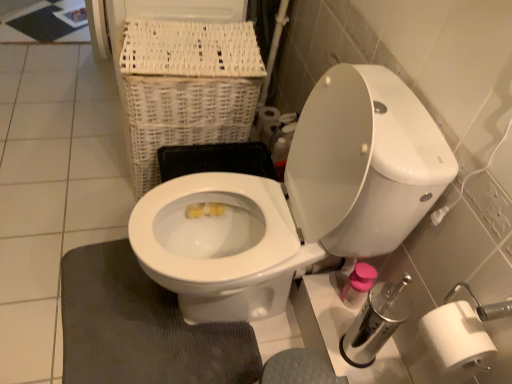
You are a GUI agent. You are given a task and a screenshot of the screen. Output one action in this format:
    pyautogui.click(x=<x>, y=<y>)
    Task: Click on the white glossy toilet at center
    This screenshot has height=384, width=512.
    Given the screenshot: What is the action you would take?
    pyautogui.click(x=298, y=200)

Locate an element on the screen. This screenshot has width=512, height=384. white matte toilet paper at right is located at coordinates (275, 125).

Image resolution: width=512 pixels, height=384 pixels. What do you see at coordinates (141, 328) in the screenshot?
I see `dark gray textured bath mat at lower left` at bounding box center [141, 328].

The image size is (512, 384). Identify the location of white glossy toilet at center. (298, 200).

How many degrees apart are the facing directions of white wicker basket at upper left and dark gray textured bath mat at lower left?

8.86 degrees.

Considering the relative positions of white wicker basket at upper left and dark gray textured bath mat at lower left in the image provided, is white wicker basket at upper left in front of dark gray textured bath mat at lower left?

No, white wicker basket at upper left is behind dark gray textured bath mat at lower left.

Is the surface of white wicker basket at upper left in direct contact with dark gray textured bath mat at lower left?

No, white wicker basket at upper left is not beside dark gray textured bath mat at lower left.

Would you consider white glossy toilet at center to be distant from white matte toilet paper at right?

That's not correct — white glossy toilet at center is a little close to white matte toilet paper at right.

Looking at their sizes, would you say white glossy toilet at center is wider or thinner than white matte toilet paper at right?

In the image, white glossy toilet at center appears to be wider than white matte toilet paper at right.

Is white glossy toilet at center positioned beyond the bounds of white matte toilet paper at right?

white glossy toilet at center is positioned outside white matte toilet paper at right.

Which is less distant, (307, 227) or (296, 124)?

Point (307, 227) appears to be closer to the viewer than point (296, 124).

Is white wicker basket at upper left at the right side of white glossy toilet at center?

Incorrect, white wicker basket at upper left is not on the right side of white glossy toilet at center.

Which object is more forward, white wicker basket at upper left or white glossy toilet at center?

white glossy toilet at center is more forward.

Is white wicker basket at upper left next to white glossy toilet at center?

No, white wicker basket at upper left is not making contact with white glossy toilet at center.

Which is in front, point (240, 44) or point (354, 97)?

The point (354, 97) is closer to the camera.

From the image's perspective, who appears lower, white glossy toilet at center or dark gray textured bath mat at lower left?

From the image's view, dark gray textured bath mat at lower left is below.

Does white glossy toilet at center come in front of dark gray textured bath mat at lower left?

Yes, white glossy toilet at center is closer to the camera.

Is white glossy toilet at center looking in the opposite direction of dark gray textured bath mat at lower left?

No, dark gray textured bath mat at lower left is not at the back of white glossy toilet at center.

Is white glossy toilet at center taller than dark gray textured bath mat at lower left?

Correct, white glossy toilet at center is much taller as dark gray textured bath mat at lower left.

Does dark gray textured bath mat at lower left turn towards white wicker basket at upper left?

No, dark gray textured bath mat at lower left is not oriented towards white wicker basket at upper left.

Is dark gray textured bath mat at lower left inside the boundaries of white wicker basket at upper left, or outside?

dark gray textured bath mat at lower left is outside white wicker basket at upper left.

Is dark gray textured bath mat at lower left taller than white wicker basket at upper left?

In fact, dark gray textured bath mat at lower left may be shorter than white wicker basket at upper left.

Considering the relative sizes of white matte toilet paper at right and white wicker basket at upper left in the image provided, is white matte toilet paper at right shorter than white wicker basket at upper left?

Yes.

Is point (279, 131) closer or farther from the camera than point (152, 105)?

Clearly, point (279, 131) is more distant from the camera than point (152, 105).

In terms of width, does white matte toilet paper at right look wider or thinner when compared to white wicker basket at upper left?

Clearly, white matte toilet paper at right has less width compared to white wicker basket at upper left.

Based on the photo, considering the relative sizes of dark gray textured bath mat at lower left and white glossy toilet at center in the image provided, is dark gray textured bath mat at lower left wider than white glossy toilet at center?

Incorrect, the width of dark gray textured bath mat at lower left does not surpass that of white glossy toilet at center.

Based on the photo, which is farther, (148, 324) or (182, 209)?

Positioned behind is point (148, 324).

From a real-world perspective, who is located higher, dark gray textured bath mat at lower left or white glossy toilet at center?

From a 3D spatial view, white glossy toilet at center is above.

Which object is further away from the camera, dark gray textured bath mat at lower left or white glossy toilet at center?

dark gray textured bath mat at lower left is behind.

Find the location of `basket behind the dark gray textured bath mat at lower left`. basket behind the dark gray textured bath mat at lower left is located at coordinates (186, 88).

Image resolution: width=512 pixels, height=384 pixels. What are the coordinates of `toilet paper above the white glossy toilet at center (from the image's perspective)` in the screenshot? It's located at (275, 125).

In the scene shown: Which object lies nearer to the anchor point white glossy toilet at center, white matte toilet paper at right or white wicker basket at upper left?

white wicker basket at upper left.

Which object lies further to the anchor point dark gray textured bath mat at lower left, white matte toilet paper at right or white wicker basket at upper left?

Based on the image, white matte toilet paper at right appears to be further to dark gray textured bath mat at lower left.

Which object lies further to the anchor point white wicker basket at upper left, dark gray textured bath mat at lower left or white glossy toilet at center?

dark gray textured bath mat at lower left is positioned further to the anchor white wicker basket at upper left.

Looking at the image, which one is located closer to white glossy toilet at center, dark gray textured bath mat at lower left or white matte toilet paper at right?

dark gray textured bath mat at lower left lies closer to white glossy toilet at center than the other object.

When comparing their distances from white matte toilet paper at right, does white wicker basket at upper left or white glossy toilet at center seem closer?

The object closer to white matte toilet paper at right is white wicker basket at upper left.

Which object lies nearer to the anchor point white matte toilet paper at right, white glossy toilet at center or dark gray textured bath mat at lower left?

white glossy toilet at center is positioned closer to the anchor white matte toilet paper at right.

When comparing their distances from dark gray textured bath mat at lower left, does white glossy toilet at center or white matte toilet paper at right seem further?

white matte toilet paper at right is further to dark gray textured bath mat at lower left.

Considering their positions, is white wicker basket at upper left positioned closer to white matte toilet paper at right than dark gray textured bath mat at lower left?

white wicker basket at upper left lies closer to white matte toilet paper at right than the other object.

I want to click on toilet between white wicker basket at upper left and dark gray textured bath mat at lower left vertically, so click(x=298, y=200).

Image resolution: width=512 pixels, height=384 pixels. I want to click on bath mat between white glossy toilet at center and white matte toilet paper at right from front to back, so click(141, 328).

Where is `basket located between white glossy toilet at center and white matte toilet paper at right in the depth direction`? The height and width of the screenshot is (384, 512). basket located between white glossy toilet at center and white matte toilet paper at right in the depth direction is located at coordinates (186, 88).

At what (x,y) coordinates should I click in order to perform the action: click on toilet paper that lies between white wicker basket at upper left and dark gray textured bath mat at lower left from top to bottom. Please return your answer as a coordinate pair (x, y). This screenshot has width=512, height=384. Looking at the image, I should click on (275, 125).